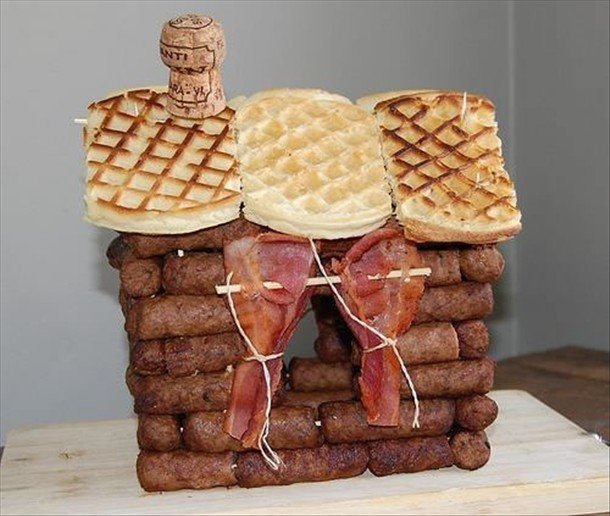
Locate an element on the screen. The width and height of the screenshot is (610, 516). white walls is located at coordinates (34, 169), (553, 133).